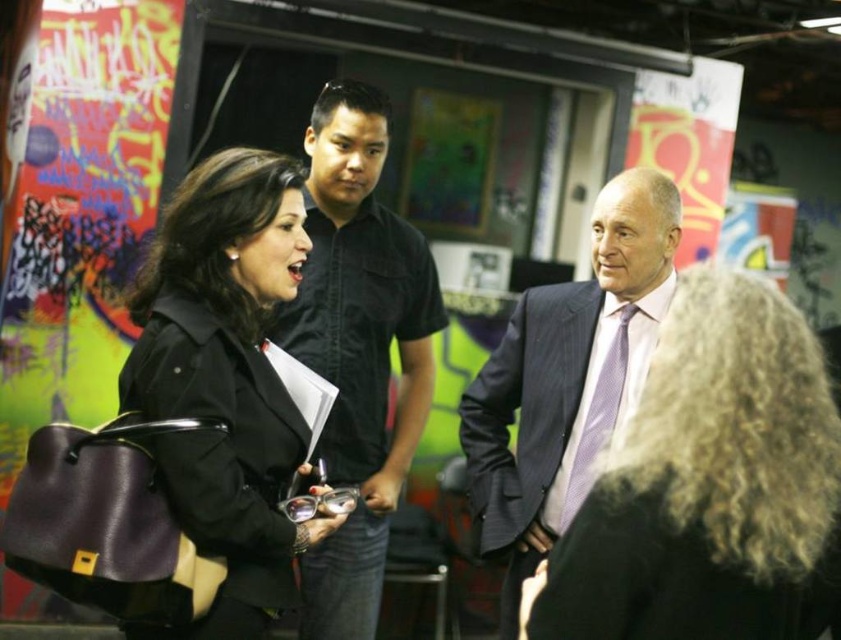
Does point (554, 442) lie behind point (582, 461)?

That is True.

Is dark blue suit at center below purple textured tie at center?

Actually, dark blue suit at center is above purple textured tie at center.

Locate an element on the screen. This screenshot has height=640, width=841. dark blue suit at center is located at coordinates (567, 378).

Does curly blonde hair at center come in front of matte black jacket at center?

Yes, it is.

Can you confirm if curly blonde hair at center is positioned to the right of matte black jacket at center?

Correct, you'll find curly blonde hair at center to the right of matte black jacket at center.

The width and height of the screenshot is (841, 640). In order to click on curly blonde hair at center in this screenshot , I will do `click(710, 486)`.

In order to click on curly blonde hair at center in this screenshot , I will do `click(710, 486)`.

Is black cotton shirt at center bigger than dark blue suit at center?

Yes.

Which is more to the right, black cotton shirt at center or dark blue suit at center?

From the viewer's perspective, dark blue suit at center appears more on the right side.

Locate an element on the screen. black cotton shirt at center is located at coordinates (358, 348).

The height and width of the screenshot is (640, 841). I want to click on black cotton shirt at center, so click(358, 348).